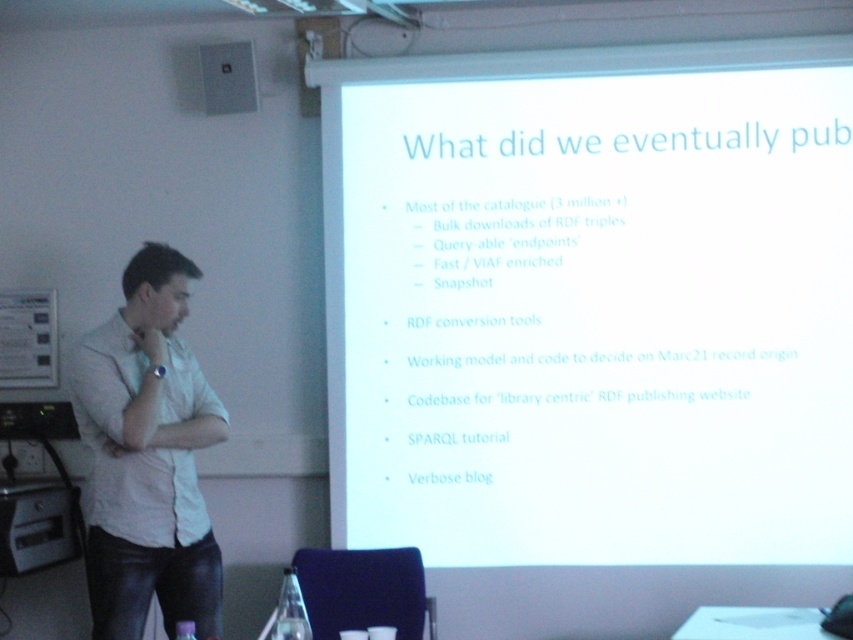
Is white matte projection screen at upper center thinner than white shirt at left?

No, white matte projection screen at upper center is not thinner than white shirt at left.

Does point (773, 280) come behind point (128, 625)?

That is True.

Locate an element on the screen. The width and height of the screenshot is (853, 640). white matte projection screen at upper center is located at coordinates (593, 305).